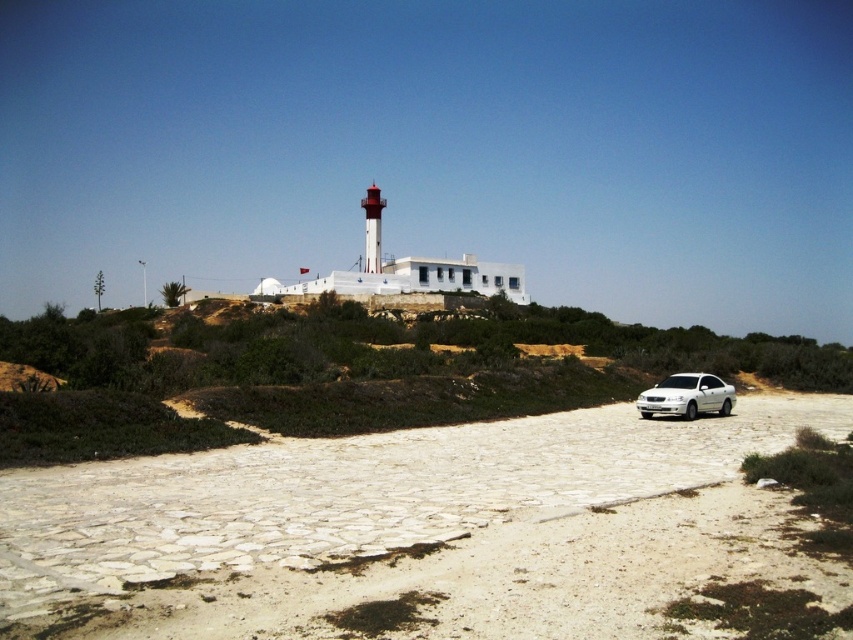
Which is below, white gravel road at center or white stone car at center?

Positioned lower is white gravel road at center.

Can you confirm if white gravel road at center is wider than white stone car at center?

In fact, white gravel road at center might be narrower than white stone car at center.

Between point (236, 477) and point (62, 451), which one is positioned behind?

The point (62, 451) is more distant.

Where is `white gravel road at center`? white gravel road at center is located at coordinates click(x=357, y=492).

Can you confirm if white stone car at center is positioned above white metallic car at lower right?

Correct, white stone car at center is located above white metallic car at lower right.

The image size is (853, 640). Describe the element at coordinates (337, 374) in the screenshot. I see `white stone car at center` at that location.

Who is more forward, (106, 390) or (645, 396)?

Point (106, 390) is in front.

This screenshot has width=853, height=640. In order to click on white stone car at center in this screenshot , I will do `click(337, 374)`.

Can you confirm if white gravel road at center is bigger than white metallic car at lower right?

Correct, white gravel road at center is larger in size than white metallic car at lower right.

I want to click on white gravel road at center, so click(357, 492).

Locate an element on the screen. white gravel road at center is located at coordinates (357, 492).